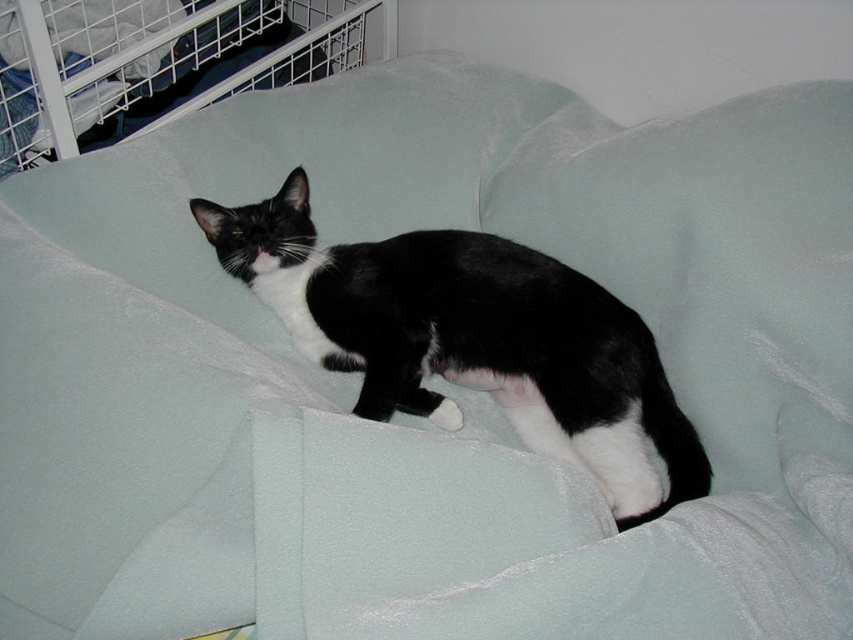
Where is `black fur cat at center`? The height and width of the screenshot is (640, 853). black fur cat at center is located at coordinates (473, 339).

Does black fur cat at center appear on the right side of brushed metal cage at upper left?

Correct, you'll find black fur cat at center to the right of brushed metal cage at upper left.

This screenshot has height=640, width=853. I want to click on black fur cat at center, so click(x=473, y=339).